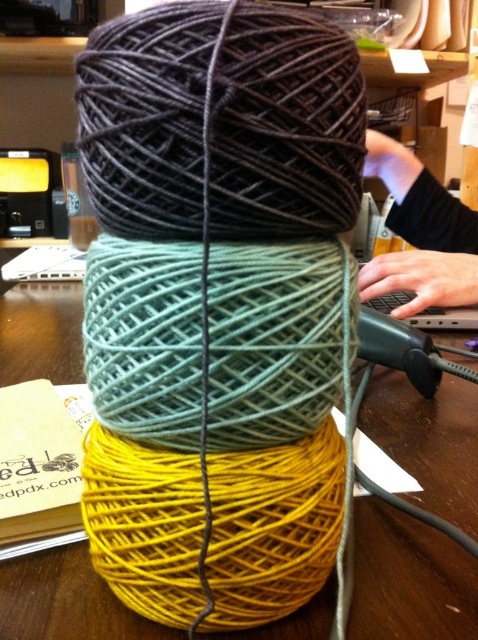
Does yellow matte yarn at center have a greater height compared to black fabric at upper right?

No.

Which is more to the right, yellow matte yarn at center or black fabric at upper right?

Positioned to the right is black fabric at upper right.

Is point (474, 522) positioned before point (426, 189)?

Yes, point (474, 522) is in front of point (426, 189).

This screenshot has height=640, width=478. Identify the location of yellow matte yarn at center. (409, 579).

Identify the location of dark brown yarn at upper center. Image resolution: width=478 pixels, height=640 pixels. (221, 124).

Is dark brown yarn at upper center wider than black fabric at upper right?

No.

Identify the location of dark brown yarn at upper center. (221, 124).

Who is taller, dark brown yarn at upper center or yellow matte yarn at center?

Standing taller between the two is yellow matte yarn at center.

Does dark brown yarn at upper center have a greater height compared to yellow matte yarn at center?

Incorrect, dark brown yarn at upper center's height is not larger of yellow matte yarn at center's.

Which is in front, point (319, 198) or point (442, 506)?

Point (319, 198) is in front.

Where is `dark brown yarn at upper center`? This screenshot has height=640, width=478. dark brown yarn at upper center is located at coordinates (221, 124).